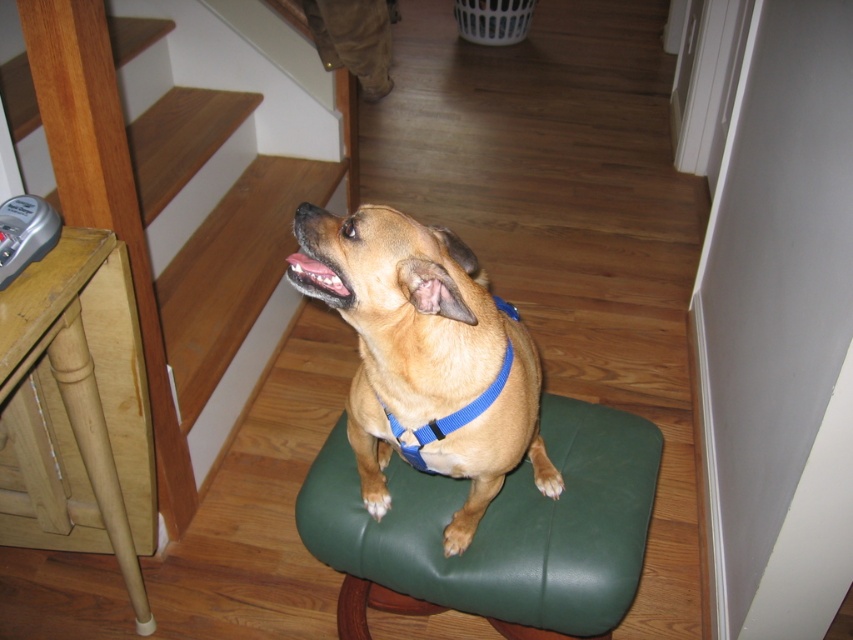
Question: Which object is farther from the camera taking this photo?

Choices:
 (A) wooden stair at left
 (B) blue fabric neckband at center
 (C) green leather stool at center
 (D) brown fabric dog at center

Answer: (C)

Question: Which point is farther to the camera?

Choices:
 (A) green leather stool at center
 (B) brown fabric dog at center
 (C) blue fabric neckband at center
 (D) wooden stair at left

Answer: (A)

Question: Which point appears closest to the camera in this image?

Choices:
 (A) (392, 429)
 (B) (105, 172)
 (C) (491, 349)

Answer: (C)

Question: Can you confirm if green leather stool at center is positioned to the left of brown fabric dog at center?

Choices:
 (A) no
 (B) yes

Answer: (A)

Question: From the image, what is the correct spatial relationship of wooden stair at left in relation to blue fabric neckband at center?

Choices:
 (A) below
 (B) above

Answer: (B)

Question: Is brown fabric dog at center further to camera compared to blue fabric neckband at center?

Choices:
 (A) no
 (B) yes

Answer: (A)